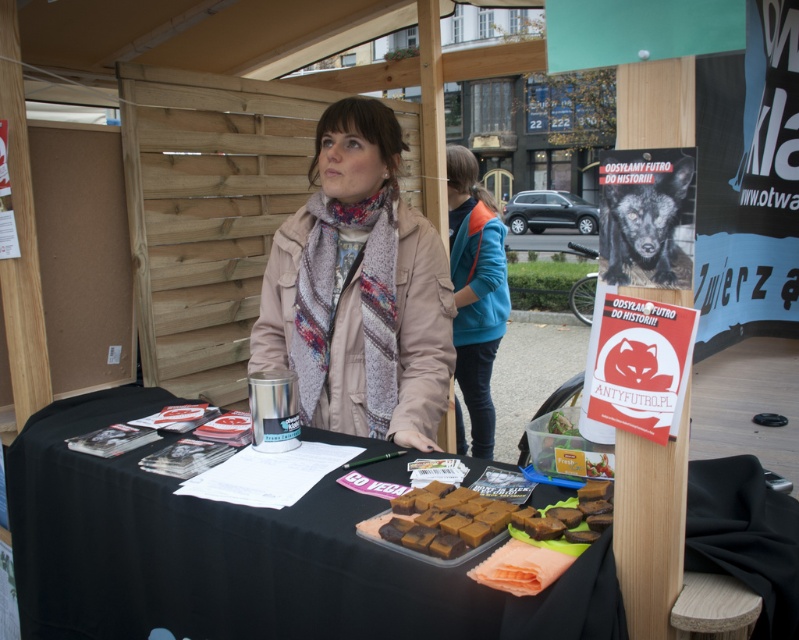
You are standing at the position marked by the point at coordinates (x=475, y=291). What object is directly in front of you?

The point at coordinates (x=475, y=291) marks the blue fabric jacket at center, so the object directly in front of you is the blue fabric jacket at center.

You are a photographer at the event and need to position a light source to ensure both the beige fabric coat at center and the brown matte fudge at lower center are well lit. Given their height difference, where should you place the light to avoid shadows?

The beige fabric coat at center is much taller than the brown matte fudge at lower center. To avoid shadows, position the light source above both objects so that the taller coat doesn